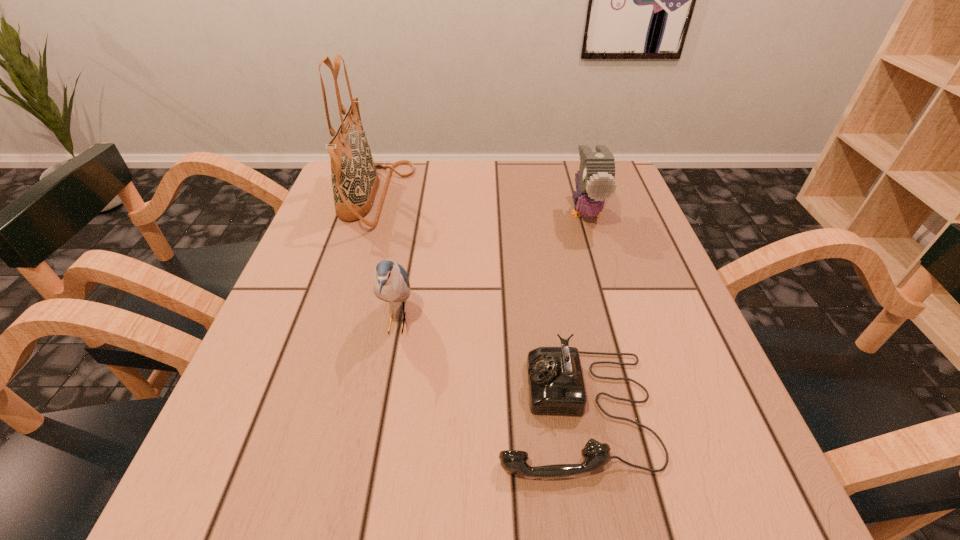
This screenshot has width=960, height=540. I want to click on free location located on the dial of the telephone, so click(291, 410).

Image resolution: width=960 pixels, height=540 pixels. I want to click on vacant space located 0.320m on the dial of the telephone, so click(291, 410).

This screenshot has width=960, height=540. Identify the location of handbag situated at the far edge. (354, 177).

Identify the location of bird at the far edge. This screenshot has width=960, height=540. (595, 180).

Locate an element on the screen. This screenshot has width=960, height=540. object situated at the near edge is located at coordinates (556, 386).

Find the location of a particular element. object that is positioned at the left edge is located at coordinates (354, 177).

Where is `bird at the right edge`? This screenshot has height=540, width=960. bird at the right edge is located at coordinates (595, 180).

I want to click on telephone located at the right edge, so click(556, 386).

This screenshot has height=540, width=960. In order to click on object at the far left corner in this screenshot , I will do `click(354, 177)`.

Identify the location of object that is at the far right corner. (595, 180).